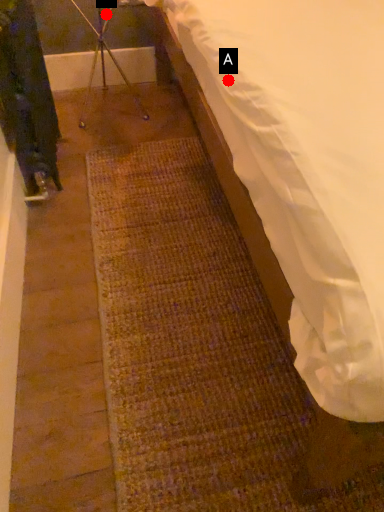
Question: Two points are circled on the image, labeled by A and B beside each circle. Among these points, which one is farthest from the camera?

Choices:
 (A) A is further
 (B) B is further

Answer: (B)